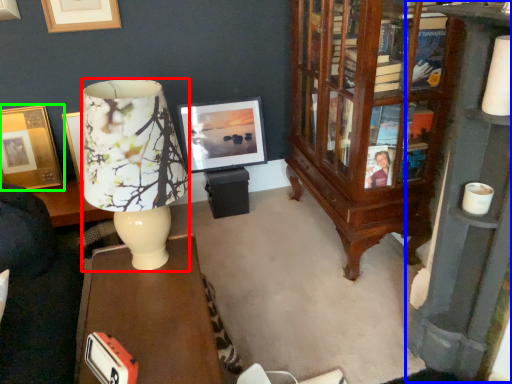
Question: Estimate the real-world distances between objects in this image. Which object is farther from lamp (highlighted by a red box), bookcase (highlighted by a blue box) or picture frame (highlighted by a green box)?

Choices:
 (A) bookcase
 (B) picture frame

Answer: (B)